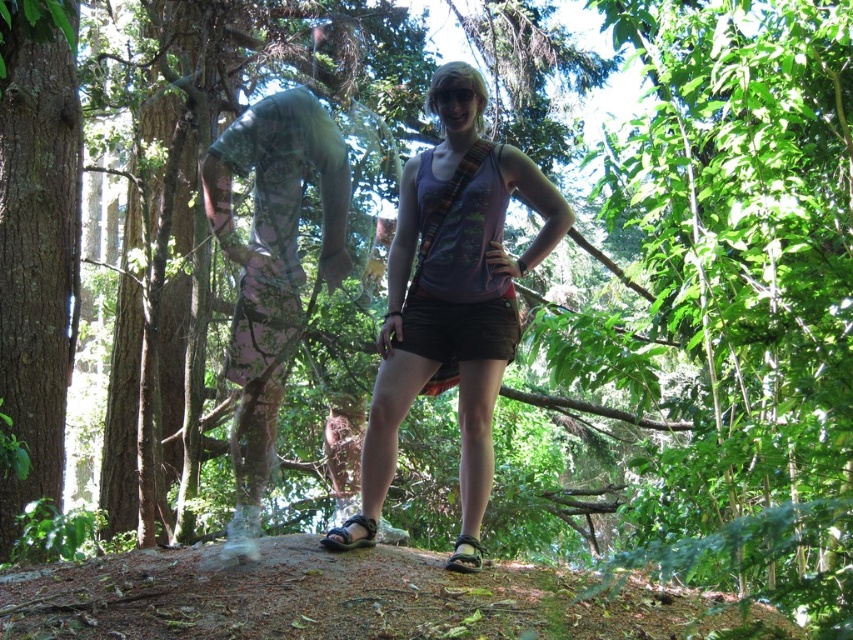
Question: Does matte purple tank top at center have a greater width compared to smooth brown bark at left?

Choices:
 (A) yes
 (B) no

Answer: (A)

Question: Is matte purple tank top at center above smooth brown bark at left?

Choices:
 (A) no
 (B) yes

Answer: (A)

Question: Does matte purple tank top at center appear under smooth brown bark at left?

Choices:
 (A) no
 (B) yes

Answer: (B)